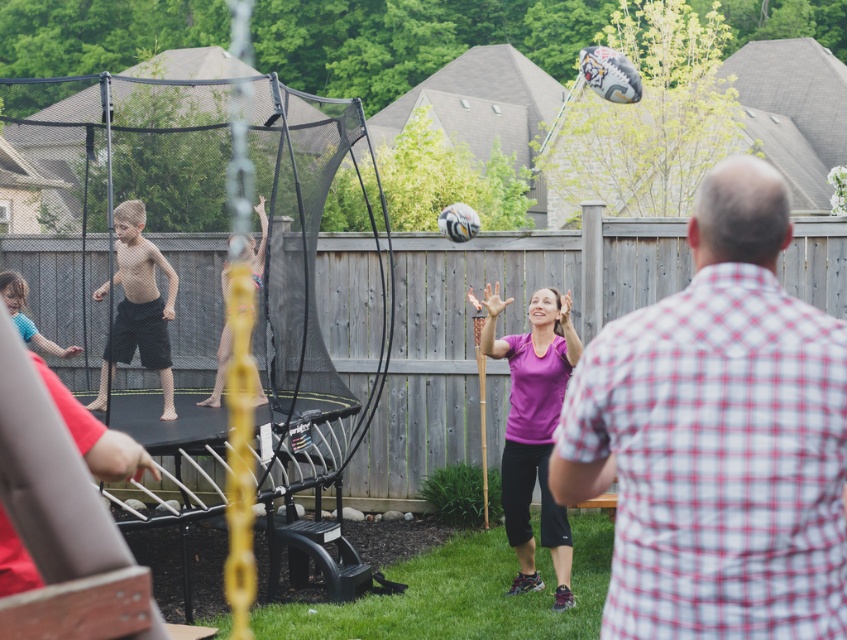
Question: Estimate the real-world distances between objects in this image. Which object is farther from the black matte shorts at center?

Choices:
 (A) pink fabric shorts at center
 (B) plaid cotton shirt at center

Answer: (B)

Question: Is plaid cotton shirt at center wider than black matte shorts at center?

Choices:
 (A) no
 (B) yes

Answer: (A)

Question: Can you confirm if black matte shorts at center is thinner than pink fabric shorts at center?

Choices:
 (A) no
 (B) yes

Answer: (A)

Question: Among these objects, which one is farthest from the camera?

Choices:
 (A) black matte shorts at center
 (B) pink fabric shorts at center

Answer: (B)

Question: Does purple matte shirt at center appear on the left side of black matte shorts at center?

Choices:
 (A) yes
 (B) no

Answer: (B)

Question: Among these points, which one is farthest from the camera?

Choices:
 (A) (523, 387)
 (B) (129, 316)
 (C) (690, 604)
 (D) (220, 369)

Answer: (D)